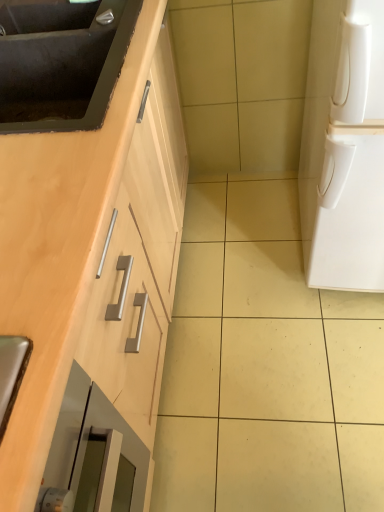
Question: Can you confirm if matte black sink at upper left, the 2th sink when ordered from top to bottom, is thinner than white matte refrigerator at right?

Choices:
 (A) yes
 (B) no

Answer: (A)

Question: From the image's perspective, would you say matte black sink at upper left, the 2th sink when ordered from top to bottom, is positioned over white matte refrigerator at right?

Choices:
 (A) no
 (B) yes

Answer: (B)

Question: Considering the relative sizes of matte black sink at upper left, the 2th sink when ordered from top to bottom, and white matte refrigerator at right in the image provided, is matte black sink at upper left, the 2th sink when ordered from top to bottom, bigger than white matte refrigerator at right?

Choices:
 (A) yes
 (B) no

Answer: (B)

Question: Considering the relative sizes of matte black sink at upper left, which is counted as the first sink, starting from the bottom, and white matte refrigerator at right in the image provided, is matte black sink at upper left, which is counted as the first sink, starting from the bottom, smaller than white matte refrigerator at right?

Choices:
 (A) no
 (B) yes

Answer: (B)

Question: Considering the relative positions of matte black sink at upper left, the 2th sink when ordered from top to bottom, and white matte refrigerator at right in the image provided, is matte black sink at upper left, the 2th sink when ordered from top to bottom, to the right of white matte refrigerator at right from the viewer's perspective?

Choices:
 (A) yes
 (B) no

Answer: (B)

Question: Considering the relative positions of white matte refrigerator at right and matte black sink at upper left, the 2th sink when ordered from top to bottom, in the image provided, is white matte refrigerator at right to the left or to the right of matte black sink at upper left, the 2th sink when ordered from top to bottom,?

Choices:
 (A) right
 (B) left

Answer: (A)

Question: Is white matte refrigerator at right situated inside matte black sink at upper left, the 2th sink when ordered from top to bottom, or outside?

Choices:
 (A) outside
 (B) inside

Answer: (A)

Question: Considering the positions of point (327, 130) and point (97, 36), is point (327, 130) closer or farther from the camera than point (97, 36)?

Choices:
 (A) closer
 (B) farther

Answer: (A)

Question: In the image, is white matte refrigerator at right positioned in front of or behind matte black sink at upper left, the 2th sink when ordered from top to bottom?

Choices:
 (A) front
 (B) behind

Answer: (A)

Question: Is matte black sink at upper left, which is the 1th sink in top-to-bottom order, wider or thinner than matte black sink at upper left, which is counted as the first sink, starting from the bottom?

Choices:
 (A) thin
 (B) wide

Answer: (A)

Question: Do you think matte black sink at upper left, which is the 1th sink in top-to-bottom order, is within matte black sink at upper left, which is counted as the first sink, starting from the bottom, or outside of it?

Choices:
 (A) inside
 (B) outside

Answer: (B)

Question: Based on their positions, is matte black sink at upper left, positioned as the 2th sink in bottom-to-top order, located to the left or right of matte black sink at upper left, which is counted as the first sink, starting from the bottom?

Choices:
 (A) left
 (B) right

Answer: (A)

Question: From a real-world perspective, is matte black sink at upper left, which is the 1th sink in top-to-bottom order, positioned above or below matte black sink at upper left, the 2th sink when ordered from top to bottom?

Choices:
 (A) above
 (B) below

Answer: (A)

Question: Looking at the image, does matte black sink at upper left, which is counted as the first sink, starting from the bottom, seem bigger or smaller compared to matte black sink at upper left, which is the 1th sink in top-to-bottom order?

Choices:
 (A) small
 (B) big

Answer: (B)

Question: Is matte black sink at upper left, which is counted as the first sink, starting from the bottom, taller or shorter than matte black sink at upper left, positioned as the 2th sink in bottom-to-top order?

Choices:
 (A) short
 (B) tall

Answer: (B)